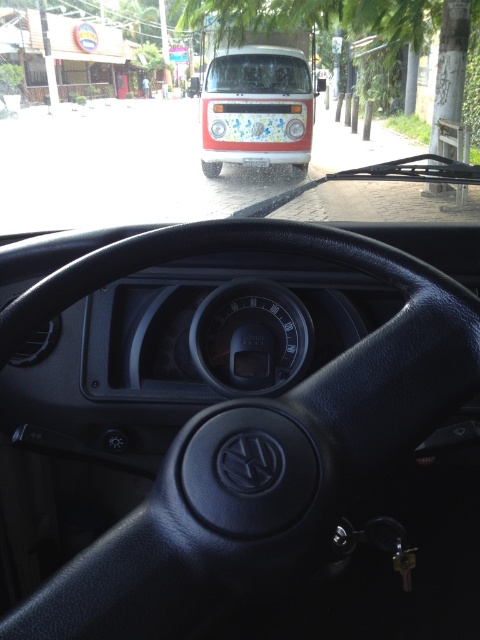
Does white glossy bus at center have a greater width compared to transparent glass windshield at center?

Indeed, white glossy bus at center has a greater width compared to transparent glass windshield at center.

Does white glossy bus at center appear under transparent glass windshield at center?

Yes, white glossy bus at center is below transparent glass windshield at center.

Measure the distance between white glossy bus at center and camera.

white glossy bus at center and camera are 25.49 feet apart.

At what (x,y) coordinates should I click in order to perform the action: click on white glossy bus at center. Please return your answer as a coordinate pair (x, y). Looking at the image, I should click on (257, 108).

Who is shorter, black leather steering wheel at center or white glossy bus at center?

black leather steering wheel at center

Can you confirm if black leather steering wheel at center is bigger than white glossy bus at center?

No, black leather steering wheel at center is not bigger than white glossy bus at center.

Is point (436, 412) positioned in front of point (264, 97)?

Yes, point (436, 412) is closer to viewer.

Locate an element on the screen. Image resolution: width=480 pixels, height=640 pixels. black leather steering wheel at center is located at coordinates (252, 440).

Is black leather steering wheel at center shorter than transparent glass windshield at center?

Yes, black leather steering wheel at center is shorter than transparent glass windshield at center.

Which is in front, point (310, 484) or point (207, 84)?

Positioned in front is point (310, 484).

You are a GUI agent. You are given a task and a screenshot of the screen. Output one action in this format:
    pyautogui.click(x=<x>, y=<y>)
    Task: Click on the black leather steering wheel at center
    The height and width of the screenshot is (640, 480).
    Given the screenshot: What is the action you would take?
    pyautogui.click(x=252, y=440)